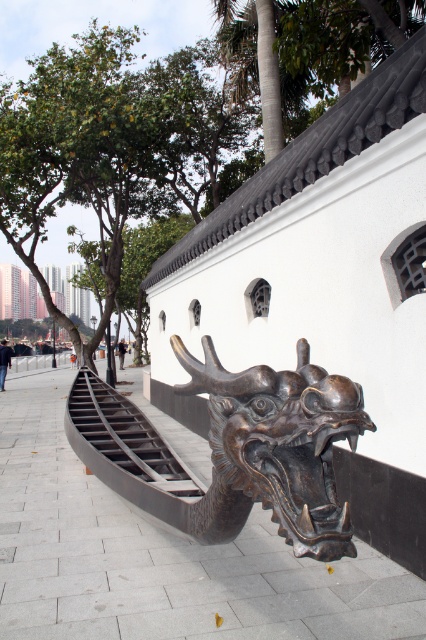
You are standing on the paved walkway in front of the dragon sculpture. There are two points marked on the ground. One is labeled as point (216, 412) and the other as point (169, 20). If you want to move closer to the dragon sculpture, which point should you step on?

You should step on point (216, 412) because it is in front of point (169, 20), meaning it is closer to the dragon sculpture.

You are standing on the paved walkway in front of the dragon sculpture. You notice two points marked on the ground. The first point is at coordinate point (0,236), and the second is at point (184,496). If you want to walk towards the building wall, which point should you step on first?

You should step on point (184,496) first because point (0,236) is behind it, meaning point (184,496) is closer to the building wall.